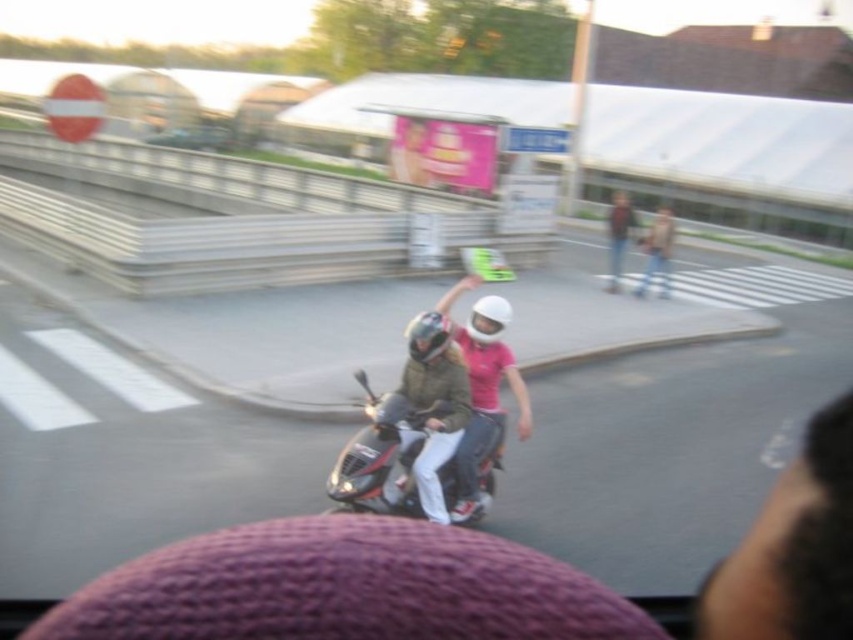
Question: Which of the following is the farthest from the observer?

Choices:
 (A) (657, 248)
 (B) (459, 328)
 (C) (374, 458)

Answer: (A)

Question: Which is nearer to the matte white helmet at center?

Choices:
 (A) shiny metallic scooter at center
 (B) light brown leather jacket at upper right

Answer: (A)

Question: Is shiny metallic scooter at center above matte white helmet at center?

Choices:
 (A) no
 (B) yes

Answer: (A)

Question: Is shiny metallic scooter at center wider than matte white helmet at center?

Choices:
 (A) yes
 (B) no

Answer: (A)

Question: Can you confirm if shiny metallic scooter at center is positioned to the left of light brown leather jacket at upper right?

Choices:
 (A) no
 (B) yes

Answer: (B)

Question: Which point is farther to the camera?

Choices:
 (A) pos(474,348)
 (B) pos(403,500)

Answer: (A)